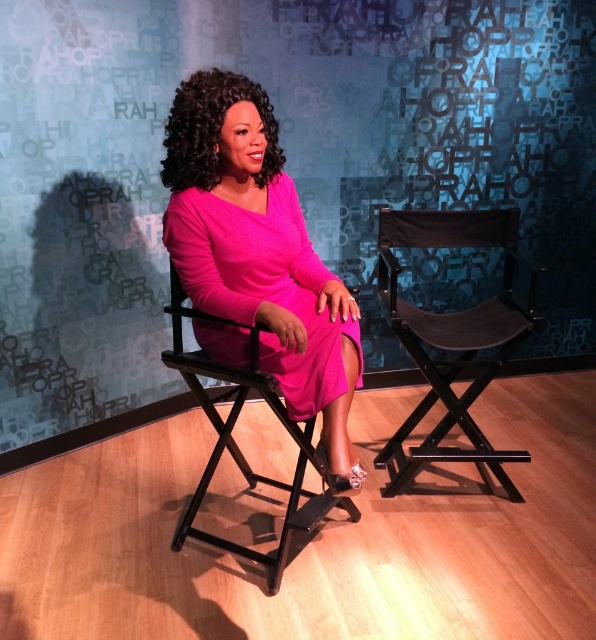
Question: Which of the following is the farthest from the observer?

Choices:
 (A) matte black director's chair at center
 (B) black fabric director's chair at right
 (C) textured fabric backdrop at upper center

Answer: (C)

Question: Which object is the closest to the textured fabric backdrop at upper center?

Choices:
 (A) matte black director's chair at center
 (B) black fabric director's chair at right

Answer: (B)

Question: From the image, what is the correct spatial relationship of pink satin dress at center in relation to matte black director's chair at center?

Choices:
 (A) below
 (B) above

Answer: (B)

Question: Which point appears farthest from the camera in this image?

Choices:
 (A) (499, 317)
 (B) (588, 97)
 (C) (281, 572)

Answer: (B)

Question: Does textured fabric backdrop at upper center lie in front of pink satin dress at center?

Choices:
 (A) yes
 (B) no

Answer: (B)

Question: Is pink satin dress at center positioned in front of matte black director's chair at center?

Choices:
 (A) yes
 (B) no

Answer: (A)